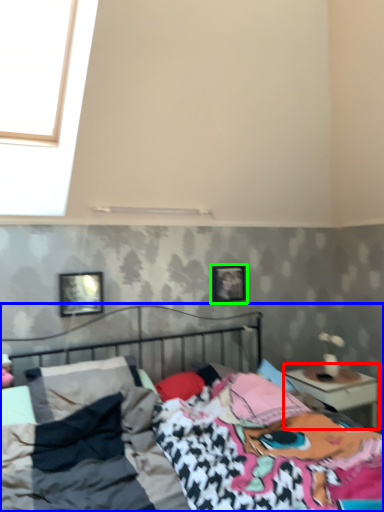
Question: Which object is the closest to the nightstand (highlighted by a red box)? Choose among these: bed (highlighted by a blue box) or picture frame (highlighted by a green box).

Choices:
 (A) bed
 (B) picture frame

Answer: (B)